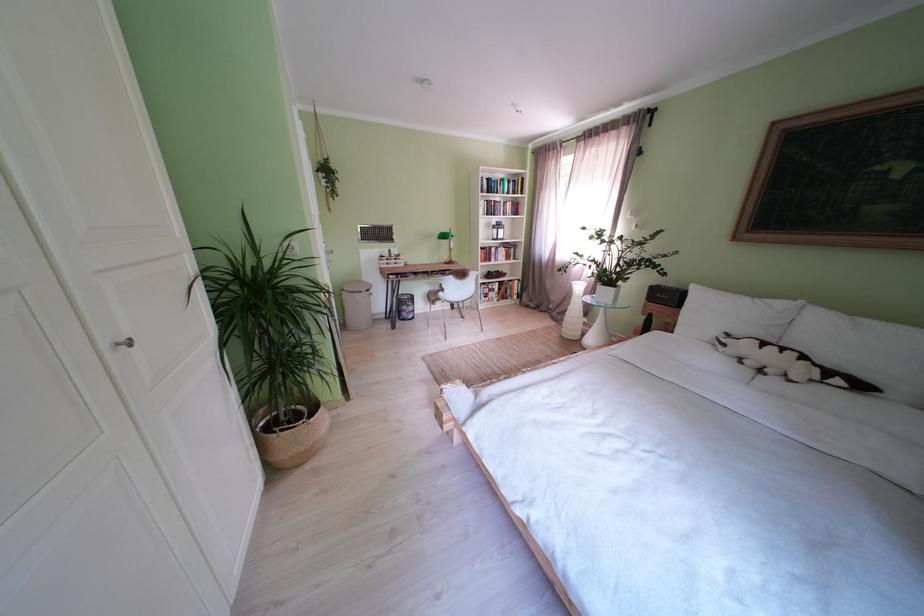
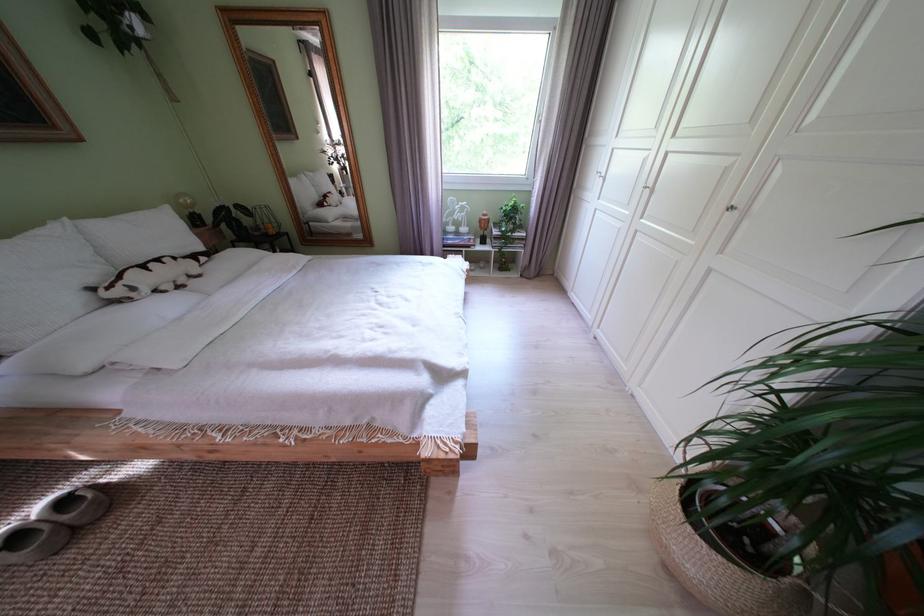
In the second image, find the point that corresponds to (735,350) in the first image.

(146, 294)